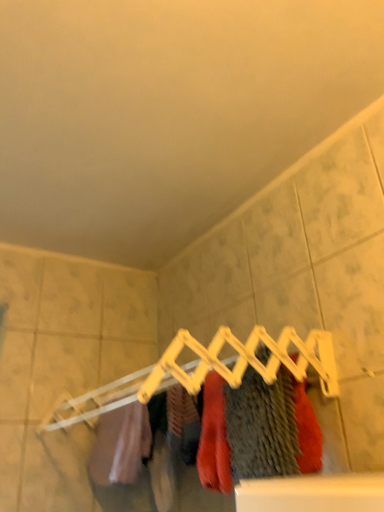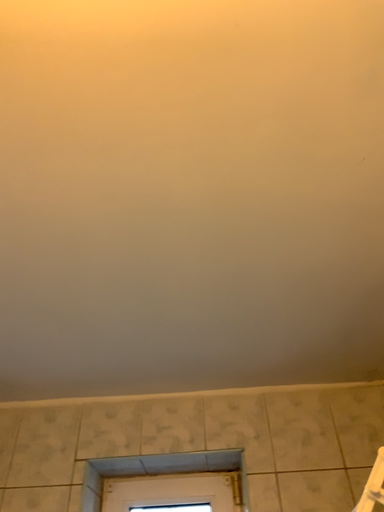
Question: How did the camera likely rotate when shooting the video?

Choices:
 (A) rotated left
 (B) rotated right

Answer: (A)